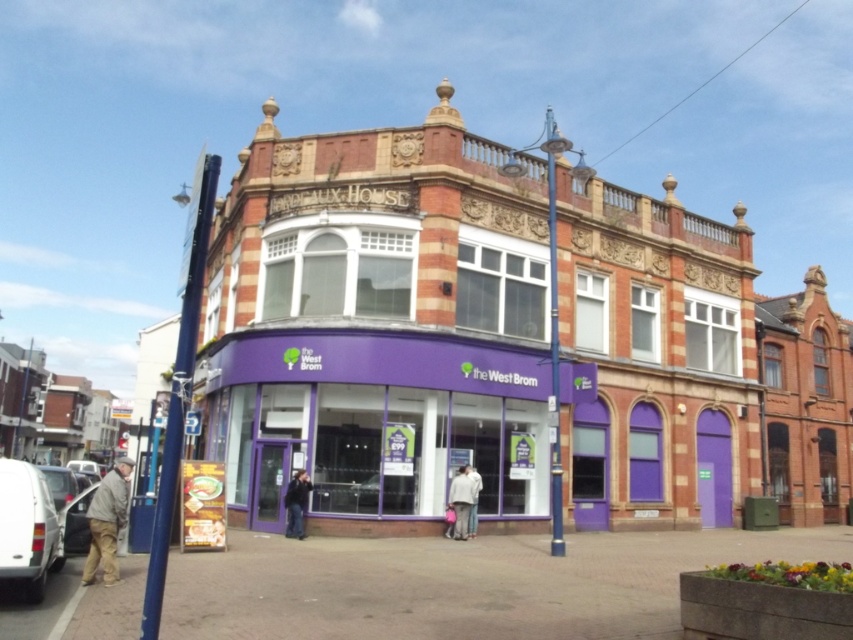
You are standing on the sidewalk in front of the corner building. You see the purple matte building at center and the purple matte bank at center. Which one is positioned to the right side from your perspective?

The purple matte building at center is to the right of the purple matte bank at center, so the purple matte building at center is positioned to the right side from your perspective.

Looking at this image, you are a delivery person with a cart that is 5 meters wide. You need to navigate between the purple matte building at center and the purple matte bank at center. Can your cart fit through the space between them?

The purple matte building at center and purple matte bank at center are 5.77 meters apart from each other. Since your cart is 5 meters wide, it can fit through the space between them as the distance is greater than the cart width.